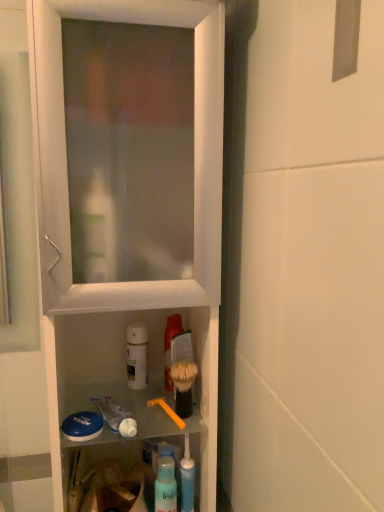
Question: Is white matte bottle at center, which ranks as the second mouthwash in right-to-left order, bigger or smaller than translucent plastic mouthwash at center, which is counted as the 2th mouthwash, starting from the left?

Choices:
 (A) small
 (B) big

Answer: (A)

Question: Is point (135, 387) closer or farther from the camera than point (168, 330)?

Choices:
 (A) closer
 (B) farther

Answer: (B)

Question: Estimate the real-world distances between objects in this image. Which object is closer to the white matte bottle at center, positioned as the first mouthwash in left-to-right order?

Choices:
 (A) white plastic cabinet at center
 (B) translucent plastic spray bottle at lower center
 (C) white glossy toothpaste at lower center
 (D) blue translucent toothpaste tube at lower center
 (E) orange plastic toothbrush at center

Answer: (E)

Question: Considering the real-world distances, which object is farthest from the translucent plastic spray bottle at lower center?

Choices:
 (A) white glossy toothpaste at lower center
 (B) white plastic cabinet at center
 (C) translucent plastic mouthwash at center, placed as the first mouthwash when sorted from right to left
 (D) white matte bottle at center, which ranks as the second mouthwash in right-to-left order
 (E) blue translucent toothpaste tube at lower center

Answer: (B)